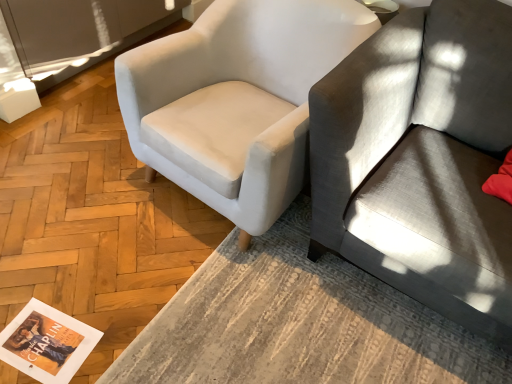
Question: Could matte paper magazine at lower left be considered to be inside textured gray rug at lower center?

Choices:
 (A) yes
 (B) no

Answer: (B)

Question: From a real-world perspective, is textured gray rug at lower center over matte paper magazine at lower left?

Choices:
 (A) yes
 (B) no

Answer: (A)

Question: Considering the relative sizes of textured gray rug at lower center and matte paper magazine at lower left in the image provided, is textured gray rug at lower center bigger than matte paper magazine at lower left?

Choices:
 (A) no
 (B) yes

Answer: (B)

Question: From a real-world perspective, is textured gray rug at lower center physically below matte paper magazine at lower left?

Choices:
 (A) yes
 (B) no

Answer: (B)

Question: Considering the relative sizes of textured gray rug at lower center and matte paper magazine at lower left in the image provided, is textured gray rug at lower center smaller than matte paper magazine at lower left?

Choices:
 (A) yes
 (B) no

Answer: (B)

Question: In terms of size, does matte paper magazine at lower left appear bigger or smaller than gray fabric couch at right?

Choices:
 (A) big
 (B) small

Answer: (B)

Question: In the image, is matte paper magazine at lower left on the left side or the right side of gray fabric couch at right?

Choices:
 (A) right
 (B) left

Answer: (B)

Question: Considering the positions of matte paper magazine at lower left and gray fabric couch at right in the image, is matte paper magazine at lower left wider or thinner than gray fabric couch at right?

Choices:
 (A) wide
 (B) thin

Answer: (B)

Question: Is matte paper magazine at lower left inside or outside of gray fabric couch at right?

Choices:
 (A) outside
 (B) inside

Answer: (A)

Question: Is textured gray rug at lower center inside or outside of white fabric chair at upper left?

Choices:
 (A) outside
 (B) inside

Answer: (A)

Question: Is textured gray rug at lower center in front of or behind white fabric chair at upper left in the image?

Choices:
 (A) behind
 (B) front

Answer: (B)

Question: Is point (307, 337) positioned closer to the camera than point (286, 77)?

Choices:
 (A) farther
 (B) closer

Answer: (B)

Question: Looking at their shapes, would you say textured gray rug at lower center is wider or thinner than white fabric chair at upper left?

Choices:
 (A) thin
 (B) wide

Answer: (B)

Question: From a real-world perspective, is white fabric chair at upper left positioned above or below textured gray rug at lower center?

Choices:
 (A) above
 (B) below

Answer: (A)

Question: In terms of width, does white fabric chair at upper left look wider or thinner when compared to textured gray rug at lower center?

Choices:
 (A) thin
 (B) wide

Answer: (A)